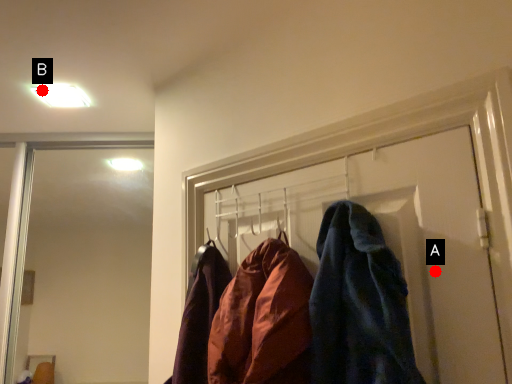
Question: Two points are circled on the image, labeled by A and B beside each circle. Which point is closer to the camera taking this photo?

Choices:
 (A) A is closer
 (B) B is closer

Answer: (A)